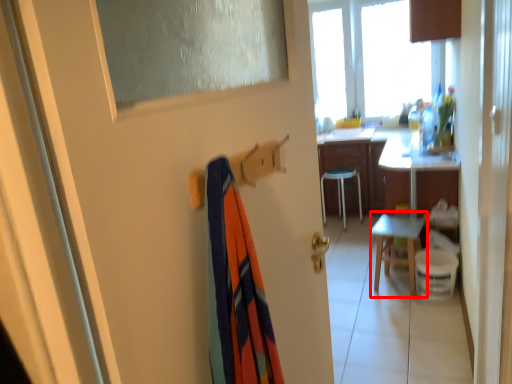
Question: From the image, what is the correct spatial relationship of chair (annotated by the red box) in relation to desk?

Choices:
 (A) right
 (B) left

Answer: (B)